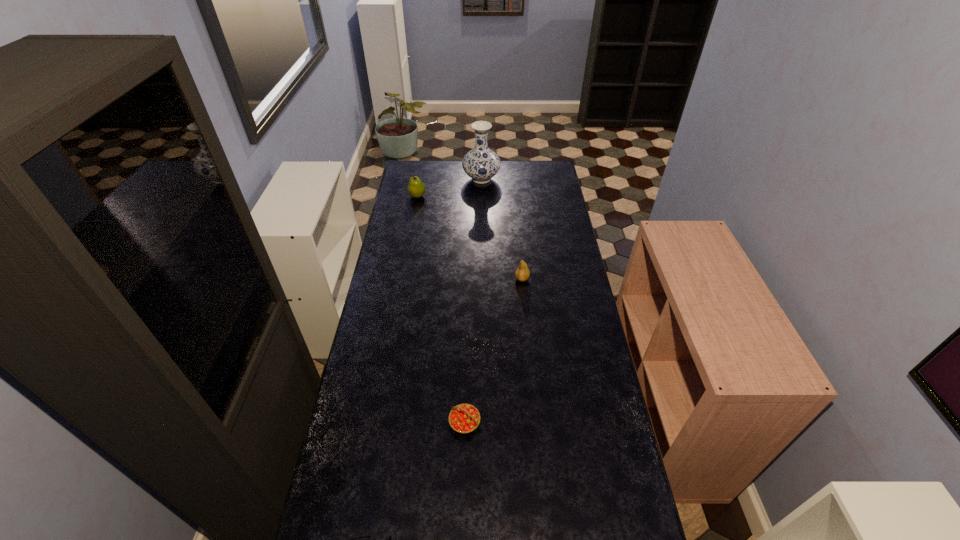
Where is `vacant space located on the front of the third farthest object`? The height and width of the screenshot is (540, 960). vacant space located on the front of the third farthest object is located at coordinates (526, 323).

At what (x,y) coordinates should I click in order to perform the action: click on vacant space located on the left of the strawberry. Please return your answer as a coordinate pair (x, y). Looking at the image, I should click on (382, 423).

Locate an element on the screen. The image size is (960, 540). object at the far edge is located at coordinates (481, 164).

The image size is (960, 540). I want to click on object at the left edge, so click(x=416, y=188).

Locate an element on the screen. free space at the left edge of the desktop is located at coordinates (413, 200).

You are a GUI agent. You are given a task and a screenshot of the screen. Output one action in this format:
    pyautogui.click(x=<x>, y=<y>)
    Task: Click on the vacant space at the right edge of the desktop
    This screenshot has height=540, width=960.
    Given the screenshot: What is the action you would take?
    pyautogui.click(x=552, y=206)

Where is `empty space that is in between the fourth farthest object and the third shortest object`? empty space that is in between the fourth farthest object and the third shortest object is located at coordinates (493, 350).

Where is `free area in between the left pear and the tallest object`? The image size is (960, 540). free area in between the left pear and the tallest object is located at coordinates (449, 187).

Where is `unoccupied position between the left pear and the third tallest object`? The width and height of the screenshot is (960, 540). unoccupied position between the left pear and the third tallest object is located at coordinates (469, 238).

Where is `empty location between the strawberry and the farther pear`? Image resolution: width=960 pixels, height=540 pixels. empty location between the strawberry and the farther pear is located at coordinates (441, 309).